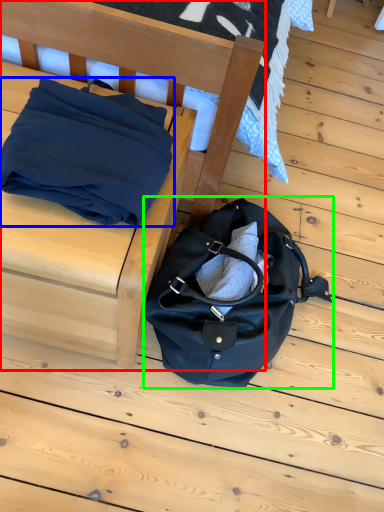
Question: Which object is the closest to the furniture (highlighted by a red box)? Choose among these: blanket (highlighted by a blue box) or handbag (highlighted by a green box).

Choices:
 (A) blanket
 (B) handbag

Answer: (A)